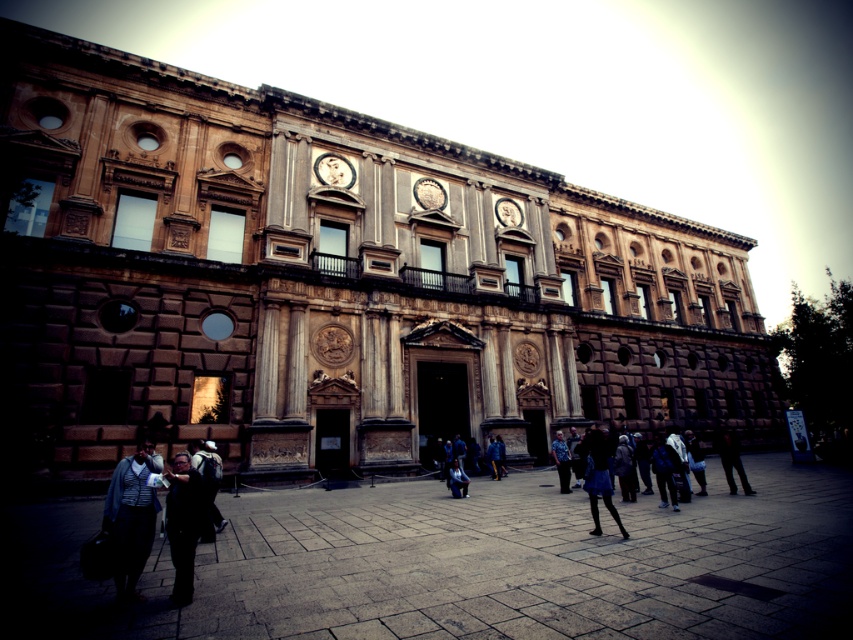
Which of these two, dark blue fabric jacket at lower left or blue denim skirt at lower center, stands taller?

Standing taller between the two is dark blue fabric jacket at lower left.

Does dark blue fabric jacket at lower left appear on the left side of blue denim skirt at lower center?

Correct, you'll find dark blue fabric jacket at lower left to the left of blue denim skirt at lower center.

The width and height of the screenshot is (853, 640). I want to click on dark blue fabric jacket at lower left, so click(x=131, y=516).

Which is more to the left, dark blue jeans at center or dark blue jeans at lower center?

From the viewer's perspective, dark blue jeans at lower center appears more on the left side.

Does dark blue jeans at center have a larger size compared to dark blue jeans at lower center?

Indeed, dark blue jeans at center has a larger size compared to dark blue jeans at lower center.

Find the location of a particular element. The width and height of the screenshot is (853, 640). dark blue jeans at center is located at coordinates (561, 460).

Is dark blue fabric jacket at lower left bigger than matte black backpack at lower left?

Yes.

Measure the distance between dark blue fabric jacket at lower left and camera.

23.27 meters

Identify the location of dark blue fabric jacket at lower left. (131, 516).